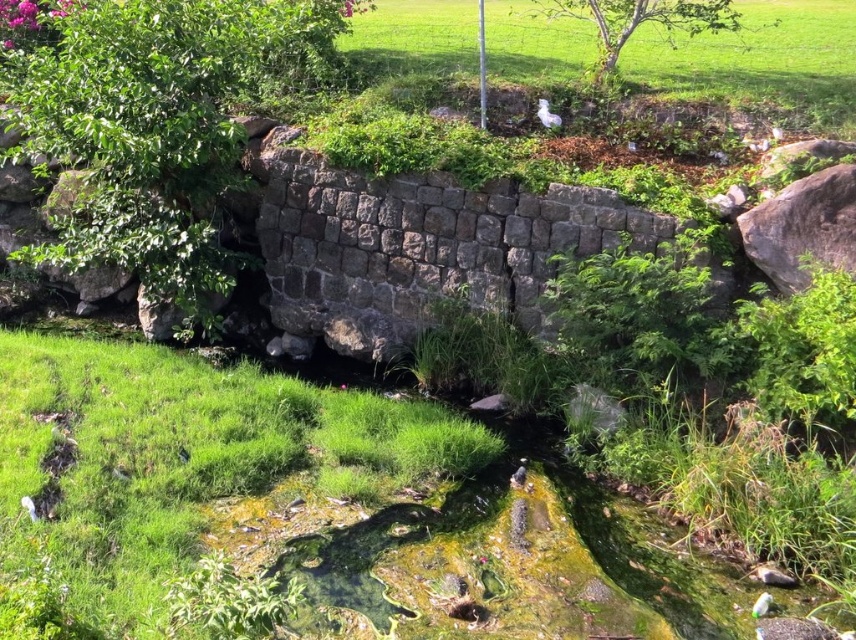
Question: Does green grass at center have a lesser width compared to white feathered bird at upper center?

Choices:
 (A) yes
 (B) no

Answer: (B)

Question: Which point appears closest to the camera in this image?

Choices:
 (A) (551, 122)
 (B) (141, 556)

Answer: (B)

Question: Is green grass at center in front of white feathered bird at upper center?

Choices:
 (A) no
 (B) yes

Answer: (B)

Question: Is green grass at center to the right of white feathered bird at upper center from the viewer's perspective?

Choices:
 (A) yes
 (B) no

Answer: (B)